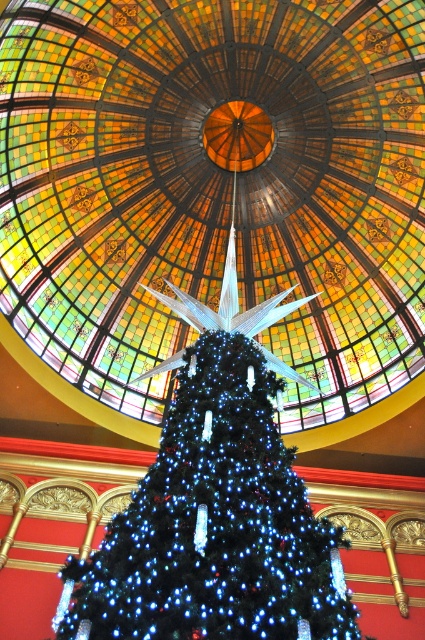
Question: Can you confirm if stained glass dome at center is positioned below blue led lights at center?

Choices:
 (A) yes
 (B) no

Answer: (B)

Question: Which point appears closest to the camera in this image?

Choices:
 (A) (215, 28)
 (B) (269, 552)

Answer: (B)

Question: Which object appears closest to the camera in this image?

Choices:
 (A) blue led lights at center
 (B) stained glass dome at center

Answer: (A)

Question: Is stained glass dome at center thinner than blue led lights at center?

Choices:
 (A) no
 (B) yes

Answer: (A)

Question: In this image, where is stained glass dome at center located relative to blue led lights at center?

Choices:
 (A) right
 (B) left

Answer: (A)